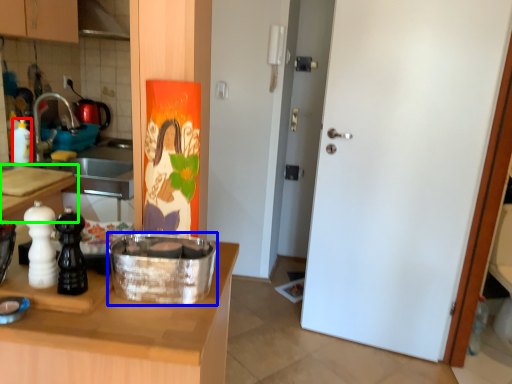
Question: Estimate the real-world distances between objects in this image. Which object is farther from bottle (highlighted by a red box), kitchen appliance (highlighted by a blue box) or countertop (highlighted by a green box)?

Choices:
 (A) kitchen appliance
 (B) countertop

Answer: (A)